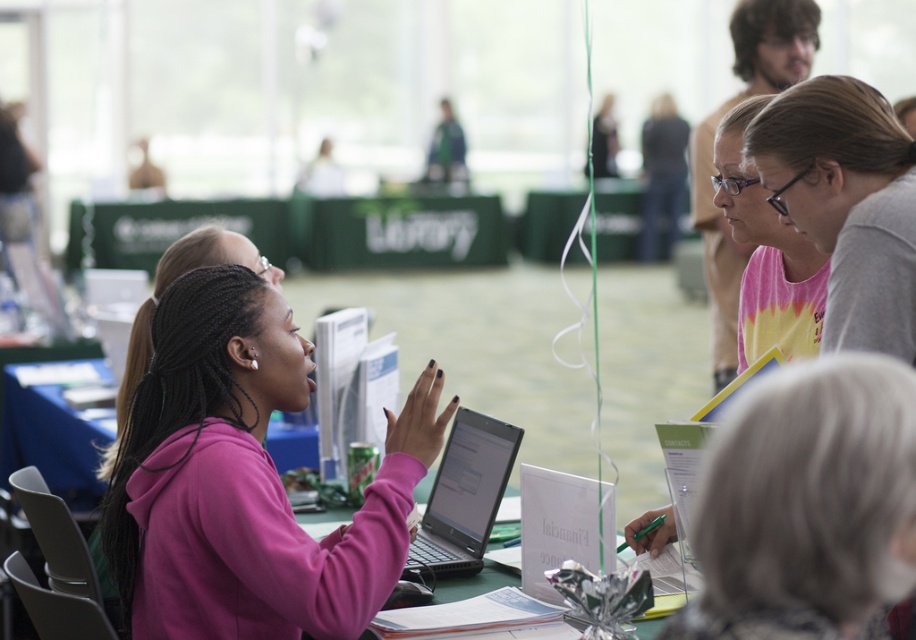
Is pink matte laptop at center thinner than gray fabric at center?

In fact, pink matte laptop at center might be wider than gray fabric at center.

Who is positioned more to the right, pink matte laptop at center or gray fabric at center?

Positioned to the right is gray fabric at center.

Does point (150, 477) come closer to viewer compared to point (842, 518)?

That is False.

Locate an element on the screen. pink matte laptop at center is located at coordinates (244, 480).

Does pink tie-dye shirt at upper right lie behind tie-dye fabric shirt at upper right?

No, pink tie-dye shirt at upper right is in front of tie-dye fabric shirt at upper right.

Does pink tie-dye shirt at upper right appear on the right side of tie-dye fabric shirt at upper right?

Correct, you'll find pink tie-dye shirt at upper right to the right of tie-dye fabric shirt at upper right.

Between point (890, 321) and point (816, 344), which one is positioned behind?

Positioned behind is point (816, 344).

Where is `pink tie-dye shirt at upper right`? The width and height of the screenshot is (916, 640). pink tie-dye shirt at upper right is located at coordinates (846, 204).

Measure the distance between pink matte laptop at center and pink tie-dye shirt at upper right.

pink matte laptop at center is 31.84 inches away from pink tie-dye shirt at upper right.

Which of these two, pink matte laptop at center or pink tie-dye shirt at upper right, stands shorter?

Standing shorter between the two is pink tie-dye shirt at upper right.

Which is behind, point (245, 468) or point (764, 154)?

The point (764, 154) is behind.

Identify the location of pink matte laptop at center. (244, 480).